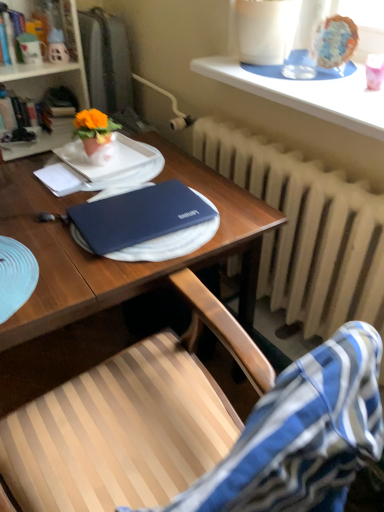
Question: Does white paper at left touch matte ceramic mug at upper left?

Choices:
 (A) yes
 (B) no

Answer: (B)

Question: Could you tell me if white paper at left is facing matte ceramic mug at upper left?

Choices:
 (A) yes
 (B) no

Answer: (B)

Question: Is white paper at left far from matte ceramic mug at upper left?

Choices:
 (A) no
 (B) yes

Answer: (A)

Question: From the image's perspective, is white paper at left under matte ceramic mug at upper left?

Choices:
 (A) yes
 (B) no

Answer: (A)

Question: Is white paper at left taller than matte ceramic mug at upper left?

Choices:
 (A) yes
 (B) no

Answer: (B)

Question: Would you say blue matte laptop at center is to the left or to the right of white paper at left in the picture?

Choices:
 (A) left
 (B) right

Answer: (B)

Question: Considering the positions of blue matte laptop at center and white paper at left in the image, is blue matte laptop at center taller or shorter than white paper at left?

Choices:
 (A) short
 (B) tall

Answer: (B)

Question: Looking at the image, does blue matte laptop at center seem bigger or smaller compared to white paper at left?

Choices:
 (A) small
 (B) big

Answer: (B)

Question: Considering the positions of blue matte laptop at center and white paper at left in the image, is blue matte laptop at center wider or thinner than white paper at left?

Choices:
 (A) wide
 (B) thin

Answer: (A)

Question: From a real-world perspective, is white paper at left above or below glazed ceramic cake at upper right?

Choices:
 (A) below
 (B) above

Answer: (A)

Question: Is white paper at left bigger or smaller than glazed ceramic cake at upper right?

Choices:
 (A) small
 (B) big

Answer: (A)

Question: Does point (66, 187) appear closer or farther from the camera than point (350, 52)?

Choices:
 (A) farther
 (B) closer

Answer: (B)

Question: Is white paper at left to the left or to the right of glazed ceramic cake at upper right in the image?

Choices:
 (A) right
 (B) left

Answer: (B)

Question: From the image's perspective, is glazed ceramic cake at upper right above or below white matte bookshelf at upper left?

Choices:
 (A) below
 (B) above

Answer: (A)

Question: From a real-world perspective, relative to white matte bookshelf at upper left, is glazed ceramic cake at upper right vertically above or below?

Choices:
 (A) below
 (B) above

Answer: (B)